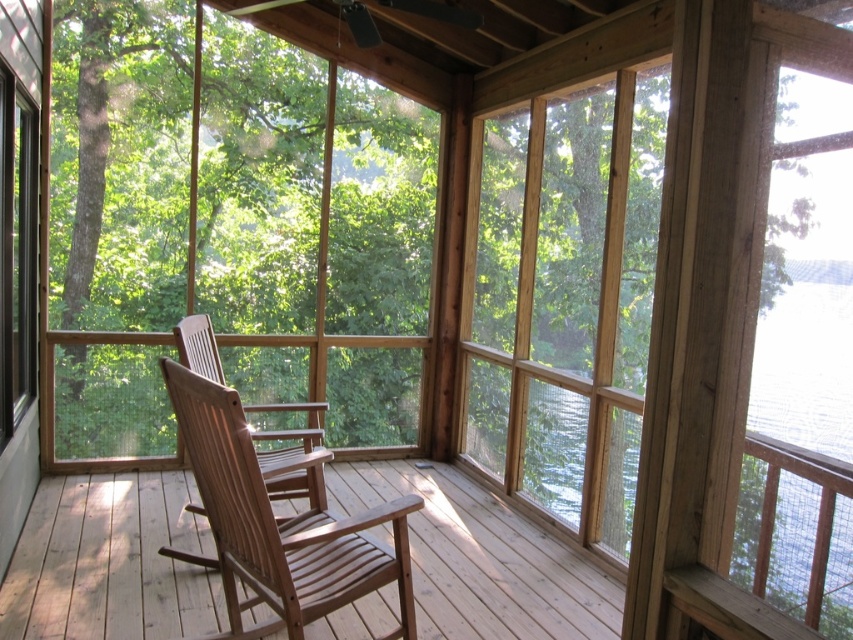
Is clear glass window at center taller than light brown wood rocking chair at center?

Yes.

Can you confirm if clear glass window at center is thinner than light brown wood rocking chair at center?

Incorrect, clear glass window at center's width is not less than light brown wood rocking chair at center's.

Between point (68, 72) and point (90, 561), which one is positioned behind?

The point (68, 72) is more distant.

I want to click on clear glass window at center, so click(x=231, y=227).

Does clear glass window at center have a greater width compared to light brown wooden rocking chair at center?

Yes, clear glass window at center is wider than light brown wooden rocking chair at center.

Does clear glass window at center have a larger size compared to light brown wooden rocking chair at center?

Indeed, clear glass window at center has a larger size compared to light brown wooden rocking chair at center.

Does point (213, 236) lie behind point (223, 481)?

Yes, point (213, 236) is farther from viewer.

I want to click on clear glass window at center, so click(x=231, y=227).

Describe the element at coordinates (270, 506) in the screenshot. I see `light brown wooden rocking chair at center` at that location.

Which is behind, point (367, 568) or point (766, 460)?

Point (766, 460)

At what (x,y) coordinates should I click in order to perform the action: click on light brown wooden rocking chair at center. Please return your answer as a coordinate pair (x, y). This screenshot has height=640, width=853. Looking at the image, I should click on (270, 506).

Locate an element on the screen. light brown wooden rocking chair at center is located at coordinates (270, 506).